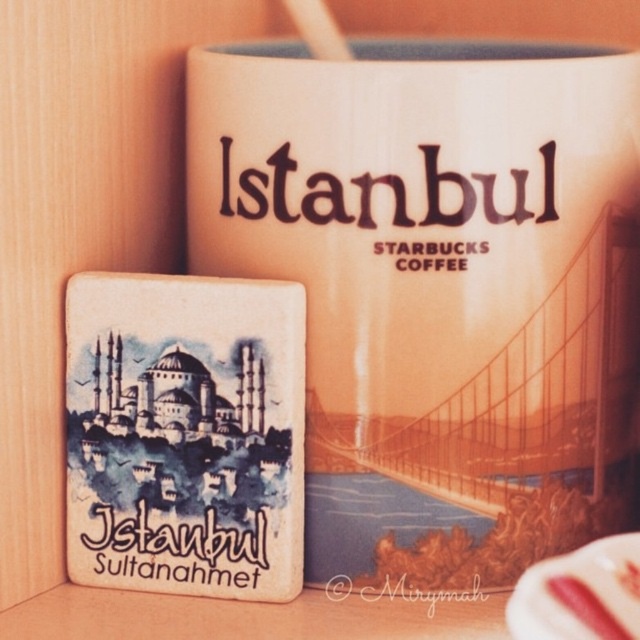
You are a barista arranging items on a counter. You have a matte ceramic mug at upper center and a white glossy saucer at lower right. The customer wants to place a 9.5 inch wide decorative plate between them. Can the plate fit in the space between the two items?

The distance between the matte ceramic mug at upper center and the white glossy saucer at lower right is 10.11 inches. Since the plate is 9.5 inches wide, it can fit in the space between them as the available space is slightly larger than the plate.

You are standing at the origin point of the image. Which of the two points, point (291, 204) or point (625, 600), is closer to you?

Point (625, 600) is closer to you because it is in front of point (291, 204).

You are standing in front of a Starbucks coffee mug and a coaster on a wooden table. The mug has an illustration of a bridge over water, and the coaster depicts the Hagia Sophia. If you were to place your finger exactly at the point labeled as point [435,284], which object would you be touching?

The point [435,284] indicates the matte ceramic mug at upper center, so you would be touching the mug.